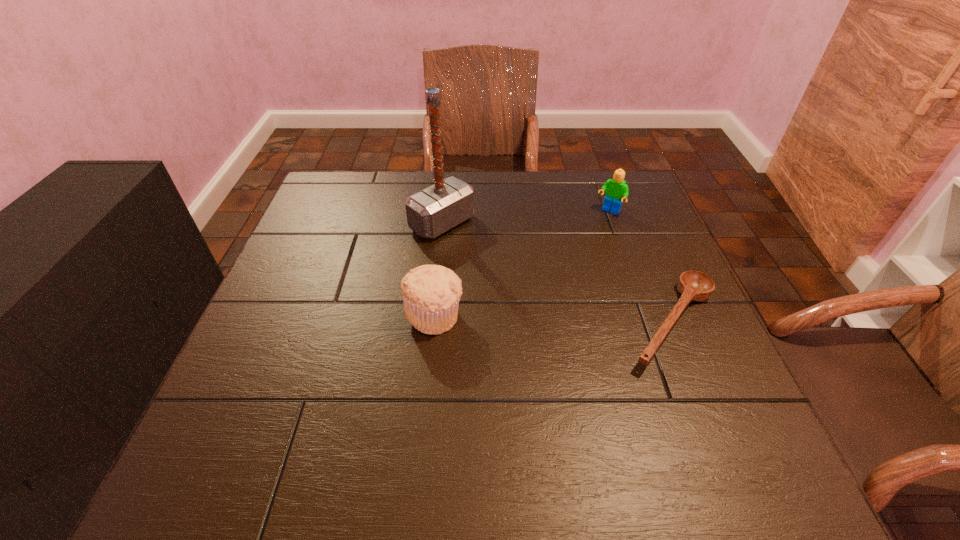
The width and height of the screenshot is (960, 540). I want to click on free space on the desktop that is between the muffin and the shortest object and is positioned on the striking surface of the tallest object, so click(x=587, y=320).

You are a GUI agent. You are given a task and a screenshot of the screen. Output one action in this format:
    pyautogui.click(x=<x>, y=<y>)
    Task: Click on the free space on the desktop that is between the muffin and the wooden spoon and is positioned on the face of the Lego
    This screenshot has height=540, width=960.
    Given the screenshot: What is the action you would take?
    pyautogui.click(x=525, y=318)